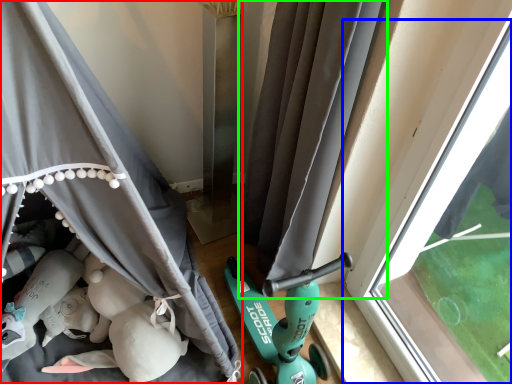
Question: Which object is positioned farthest from curtain (highlighted by a red box)? Select from window (highlighted by a blue box) and curtain (highlighted by a green box).

Choices:
 (A) window
 (B) curtain

Answer: (A)